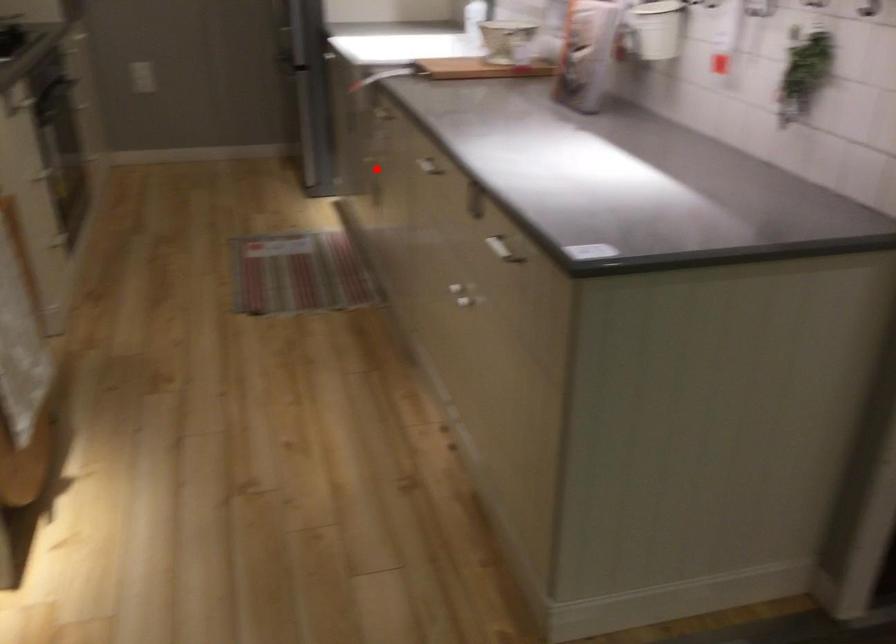
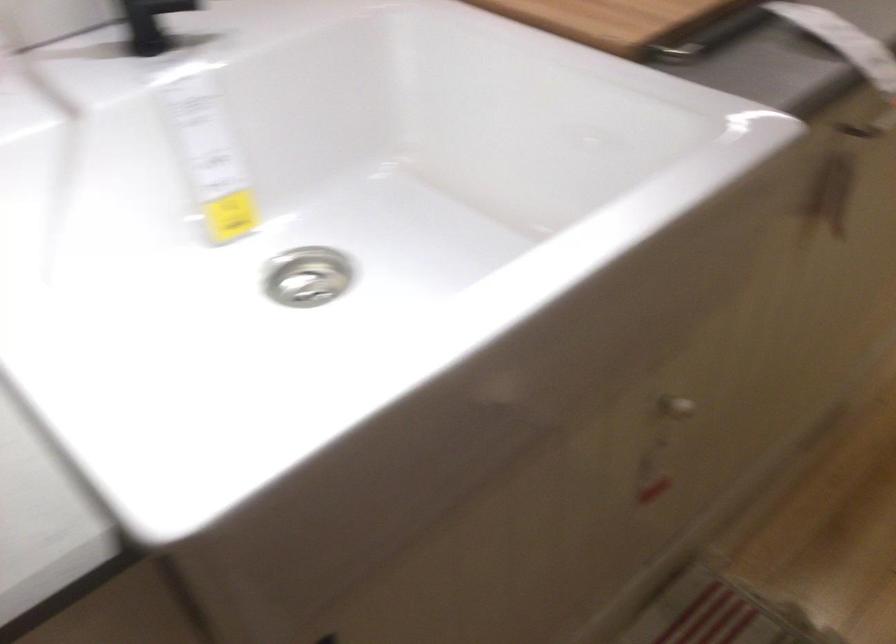
Question: I am providing you with two images of the same scene from different viewpoints. Given a red point in image1, look at the same physical point in image2. Is it:

Choices:
 (A) Closer to the viewpoint
 (B) Farther from the viewpoint

Answer: (A)